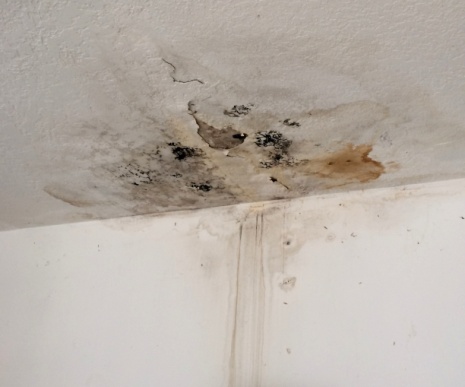
Where is `empty space on ceiling top left of stains`? Image resolution: width=465 pixels, height=387 pixels. empty space on ceiling top left of stains is located at coordinates (40, 58).